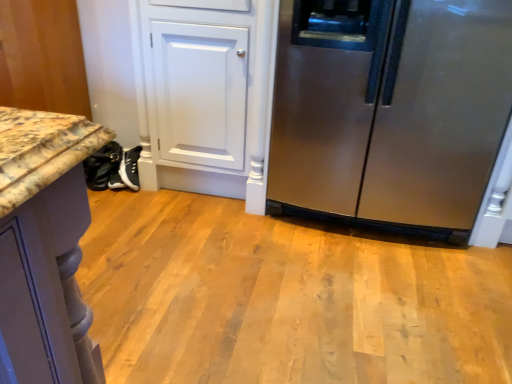
You are a GUI agent. You are given a task and a screenshot of the screen. Output one action in this format:
    pyautogui.click(x=<x>, y=<y>)
    Task: Click on the unoccupied area in front of stainless steel refrigerator at right
    
    Given the screenshot: What is the action you would take?
    pyautogui.click(x=364, y=303)